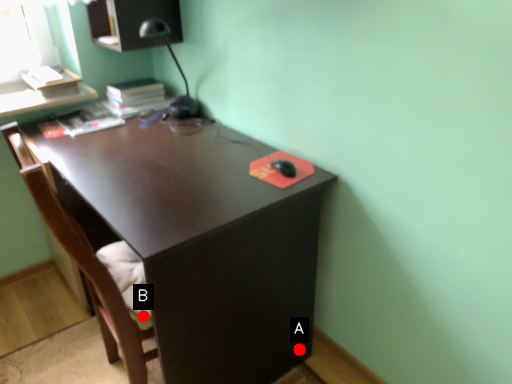
Question: Two points are circled on the image, labeled by A and B beside each circle. Which point is further to the camera?

Choices:
 (A) A is further
 (B) B is further

Answer: (A)